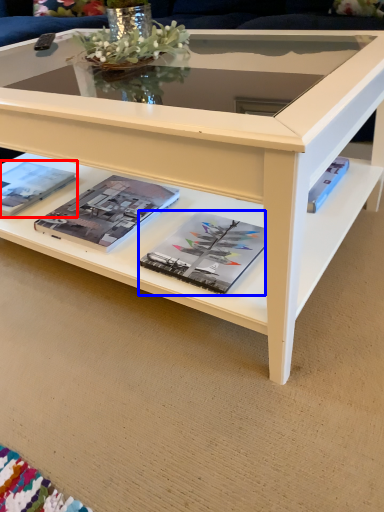
Question: Which point is further to the camera, magazine (highlighted by a red box) or magazine (highlighted by a blue box)?

Choices:
 (A) magazine
 (B) magazine

Answer: (A)